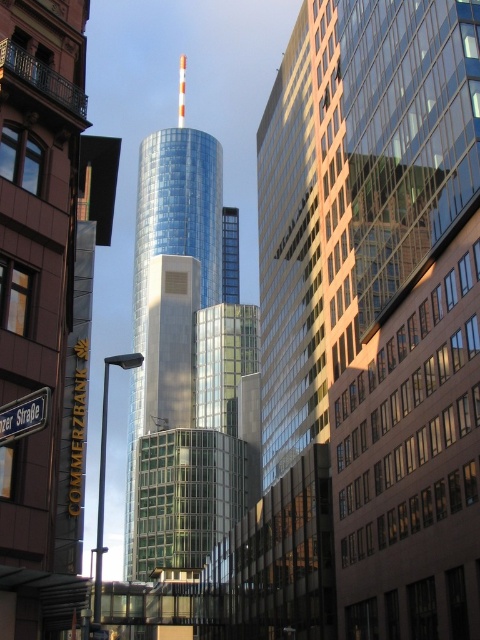
You are standing in front of the Commerzbank Tower and see two points marked on the glass facade. The first point is at coordinates point [208,314] and the second is at point [8,432]. Which point is closer to your eyes?

Point [208,314] is further to the camera than point [8,432], so the point closer to your eyes is point [8,432].

You are standing at point [187,358] in the urban scene. What object is located exactly at this point?

The shiny glass tower at center is located exactly at point [187,358].

You are a city planner assessing the impact of new construction on sunlight access. You observe the shiny glass tower at center and the black metal street sign at lower left. Which object would cast a longer shadow during midday?

The shiny glass tower at center has a larger size compared to the black metal street sign at lower left, so it would cast a longer shadow during midday.